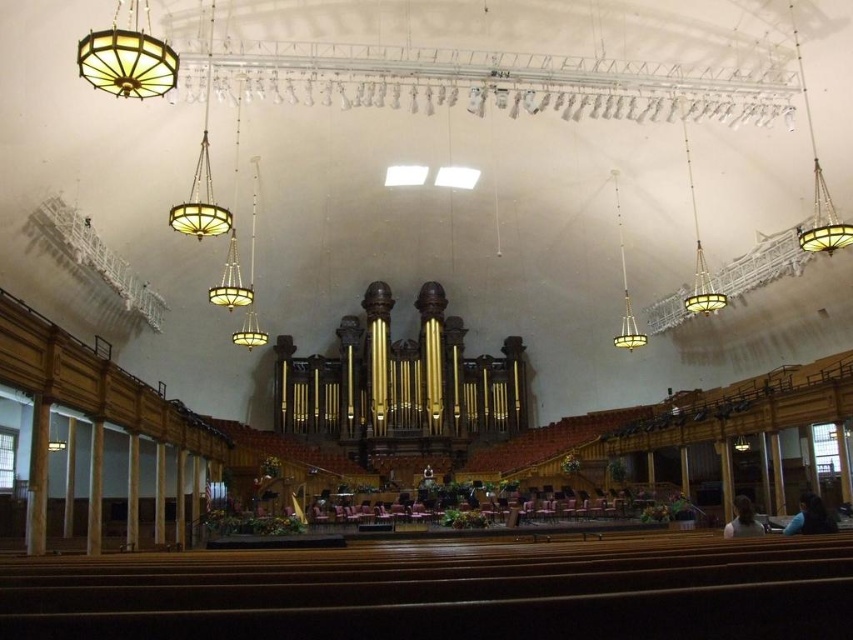
Question: Which point is farther to the camera?

Choices:
 (A) matte glass chandelier at upper center
 (B) matte gold chandelier at upper center

Answer: (B)

Question: Is matte glass chandelier at upper center positioned before matte gold chandelier at upper center?

Choices:
 (A) yes
 (B) no

Answer: (A)

Question: Which point is farther from the camera taking this photo?

Choices:
 (A) (621, 333)
 (B) (692, 176)

Answer: (A)

Question: Does matte glass chandelier at upper center have a greater width compared to matte gold chandelier at upper center?

Choices:
 (A) no
 (B) yes

Answer: (B)

Question: In this image, where is matte glass chandelier at upper center located relative to matte gold chandelier at upper center?

Choices:
 (A) below
 (B) above

Answer: (B)